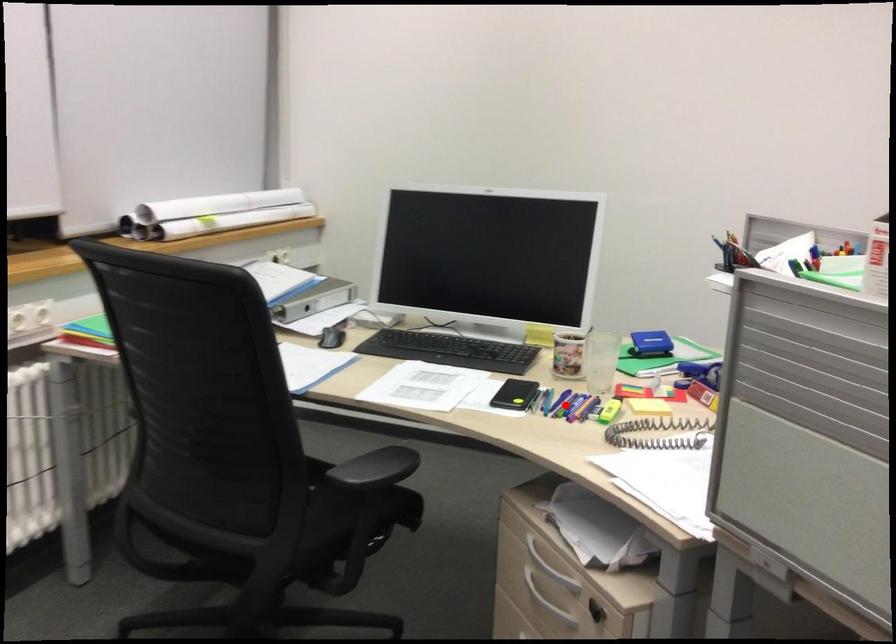
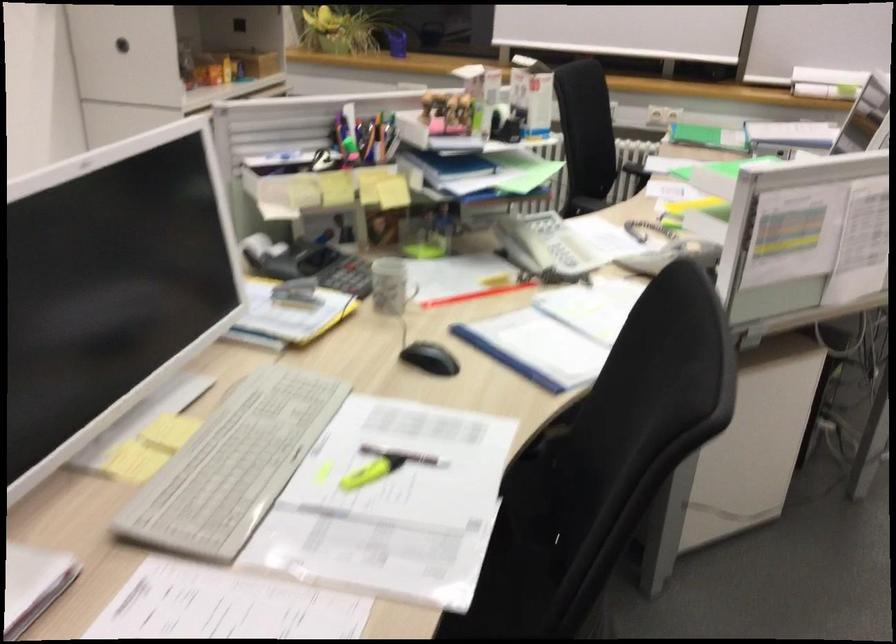
Question: I am providing you with two images of the same scene from different viewpoints. A red point is marked on the first image. Can you still see the location of the red point in image 2?

Choices:
 (A) Yes
 (B) No

Answer: (B)